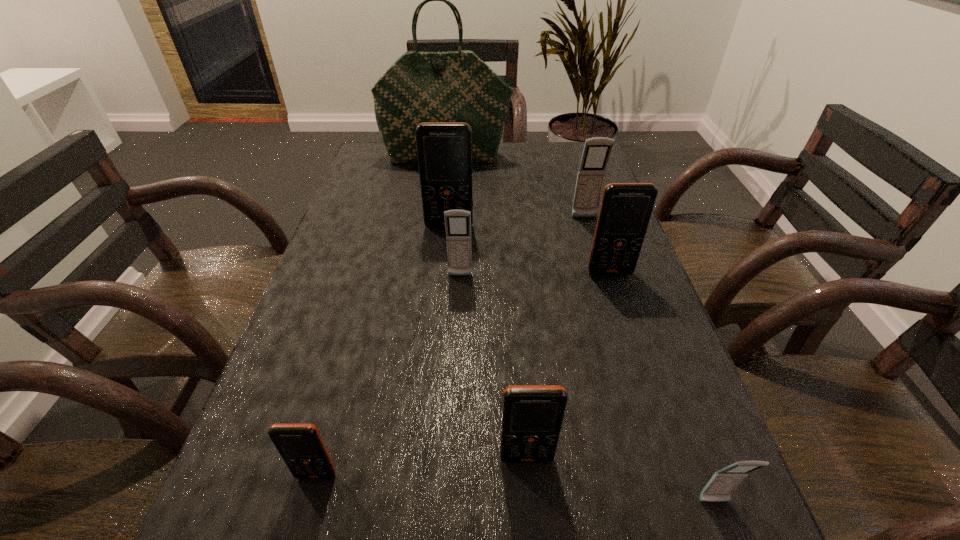
Image resolution: width=960 pixels, height=540 pixels. I want to click on vacant space that's between the rightmost gray cellular telephone and the third orange cellular telephone from left to right, so click(x=620, y=480).

Identify the location of free spot between the smallest orange cellular telephone and the farthest object. The width and height of the screenshot is (960, 540). (381, 316).

At what (x,y) coordinates should I click in order to perform the action: click on blank region between the biggest gray cellular telephone and the leftmost orange cellular telephone. Please return your answer as a coordinate pair (x, y). Looking at the image, I should click on [450, 346].

The height and width of the screenshot is (540, 960). Identify the location of free space between the rightmost gray cellular telephone and the sixth farthest cellular telephone. (516, 488).

Identify the location of vacant area that lies between the nearest cellular telephone and the fifth farthest cellular telephone. (620, 480).

Identify the location of free spot between the third smallest orange cellular telephone and the farthest orange cellular telephone. (530, 249).

Locate an element on the screen. vacant area that lies between the second nearest orange cellular telephone and the second nearest gray cellular telephone is located at coordinates (493, 367).

The width and height of the screenshot is (960, 540). I want to click on empty location between the second nearest cellular telephone and the biggest gray cellular telephone, so click(x=450, y=346).

Locate an element on the screen. vacant region between the nearest object and the leftmost gray cellular telephone is located at coordinates [x=587, y=389].

Where is `object that is the sixth nearest to the third smallest orange cellular telephone`? The image size is (960, 540). object that is the sixth nearest to the third smallest orange cellular telephone is located at coordinates (457, 86).